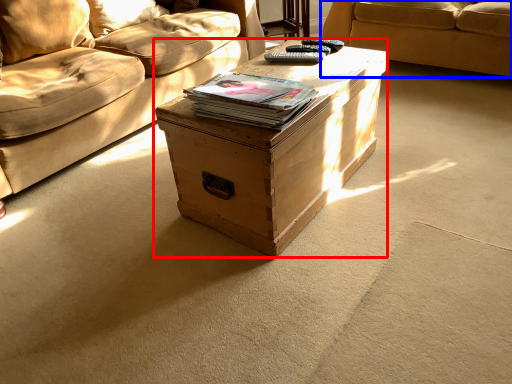
Question: Which of the following is the farthest to the observer, table (highlighted by a red box) or studio couch (highlighted by a blue box)?

Choices:
 (A) table
 (B) studio couch

Answer: (B)